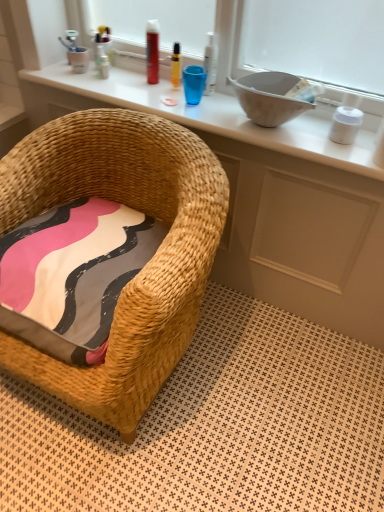
Question: Would you say pink fabric pillow at lower left is inside or outside white matte container at upper right, marked as the 1th toiletry in a right-to-left arrangement?

Choices:
 (A) inside
 (B) outside

Answer: (B)

Question: From the image's perspective, is pink fabric pillow at lower left above or below white matte container at upper right, which appears as the 5th toiletry when viewed from the left?

Choices:
 (A) above
 (B) below

Answer: (B)

Question: Estimate the real-world distances between objects in this image. Which object is closer to the translucent yellow bottle at upper center, the third toiletry viewed from the left?

Choices:
 (A) woven straw chair at lower left
 (B) woven wood changing table at upper center
 (C) white matte container at upper right, marked as the 1th toiletry in a right-to-left arrangement
 (D) pink fabric pillow at lower left
 (E) gray matte bowl at upper right

Answer: (B)

Question: Estimate the real-world distances between objects in this image. Which object is farther from the white plastic bottle at upper center, which ranks as the 1th toiletry in left-to-right order?

Choices:
 (A) woven wood changing table at upper center
 (B) shiny red can at upper center, the second toiletry viewed from the left
 (C) translucent yellow bottle at upper center, placed as the third toiletry when sorted from right to left
 (D) matte wicker vanity at center
 (E) woven straw chair at lower left

Answer: (D)